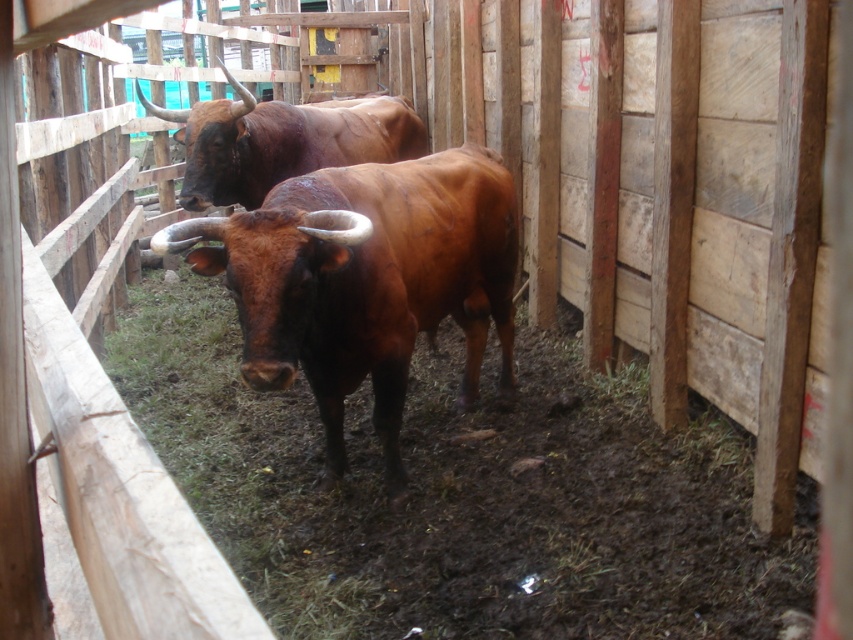
You are a farmer checking the distance between the bulls to ensure they have enough space. Given that each bull requires 3 feet of personal space, is the distance between the brown glossy bull at center and the brown glossy bull at upper center sufficient?

The distance between the brown glossy bull at center and the brown glossy bull at upper center is 4.32 feet, which is more than the required 3 feet of personal space. Therefore, the distance is sufficient.

You are a farmer checking the size of your bulls in the pen. You see the brown glossy bull at center and the brown glossy bull at upper center. Which bull takes up more space in the pen?

The brown glossy bull at upper center takes up more space than the brown glossy bull at center because it occupies more space according to the description.